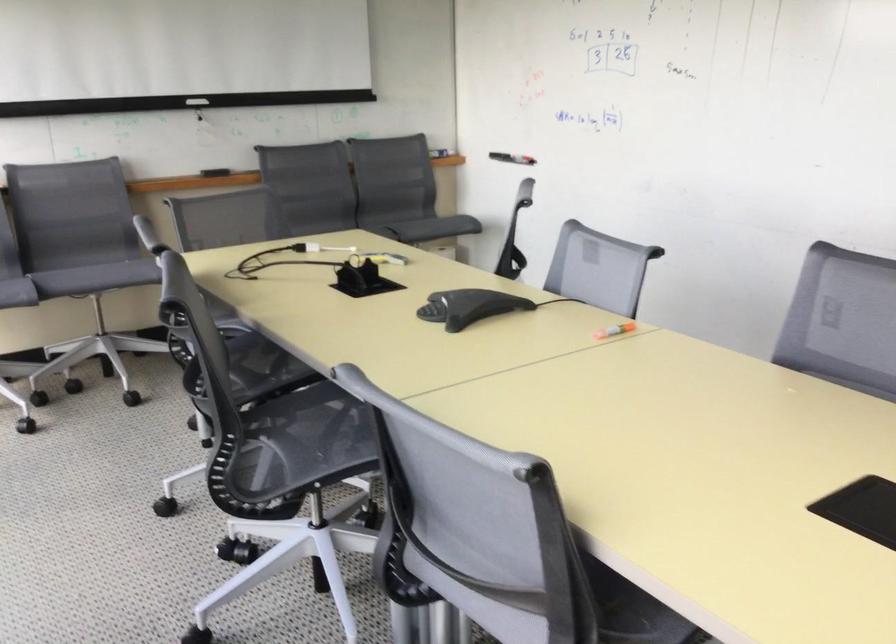
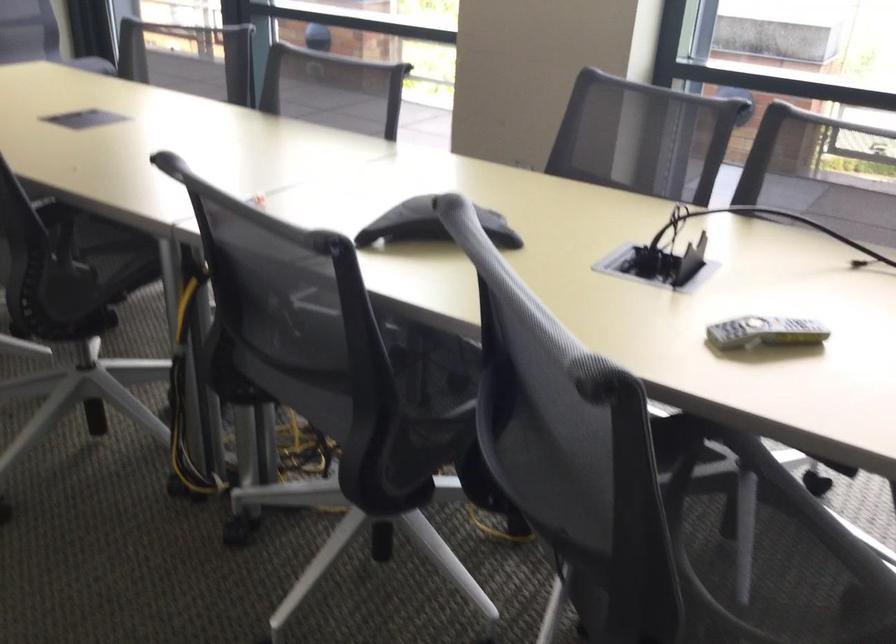
Find the pixel in the second image that matches [375,261] in the first image.

(764, 332)